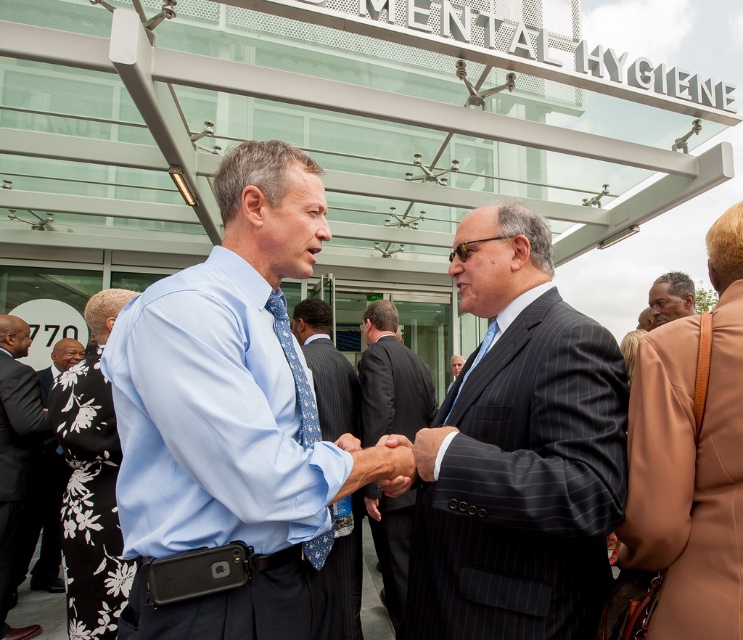
Which is more to the right, dark blue suit at center or black floral dress at lower left?

dark blue suit at center is more to the right.

Which is more to the left, dark blue suit at center or black floral dress at lower left?

black floral dress at lower left is more to the left.

The height and width of the screenshot is (640, 743). What are the coordinates of `dark blue suit at center` in the screenshot? It's located at 392,380.

Locate an element on the screen. Image resolution: width=743 pixels, height=640 pixels. dark blue suit at center is located at coordinates (392, 380).

Is blue patterned tie at center thinner than dark brown leather jacket at right?

No, blue patterned tie at center is not thinner than dark brown leather jacket at right.

Between blue patterned tie at center and dark brown leather jacket at right, which one is positioned lower?

blue patterned tie at center is below.

Is point (351, 563) in front of point (666, 298)?

No, (351, 563) is behind (666, 298).

Identify the location of blue patterned tie at center. The width and height of the screenshot is (743, 640). (327, 369).

Which is behind, point (314, 227) or point (418, 458)?

Point (314, 227)

Between light blue shirt at center and dark gray pinstripe suit at center, which one is positioned lower?

Positioned lower is dark gray pinstripe suit at center.

Who is more distant from viewer, (169, 378) or (510, 554)?

The point (510, 554) is more distant.

Locate an element on the screen. light blue shirt at center is located at coordinates (233, 419).